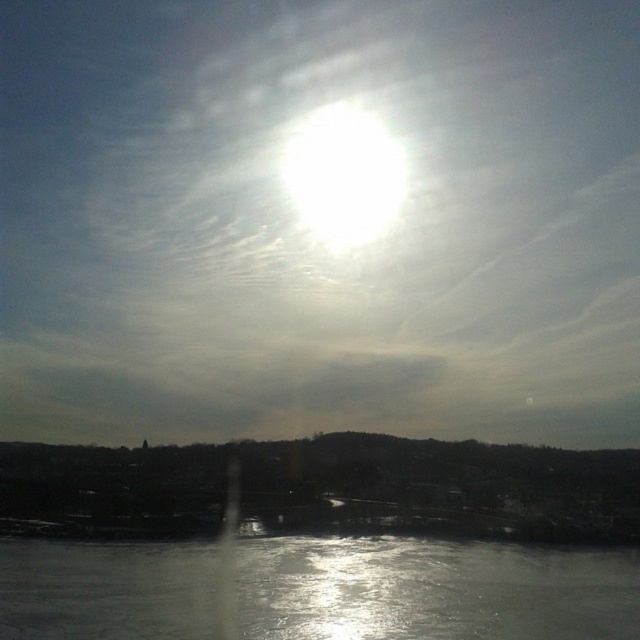
You are a photographer standing at the edge of the glistening ice at bottom, aiming to capture the bright white sun at upper center in your shot. Considering the distance between them, would you need to adjust your camera settings to account for the brightness difference?

The distance between the bright white sun at upper center and the glistening ice at bottom is 140.74 meters. Since the sun is extremely bright and the ice is much closer, you should adjust your camera settings to balance exposure, perhaps using a graduated neutral density filter to handle the extreme contrast between the bright sun and the darker ice.

You are an astronomer observing the winter landscape. You notice the bright white sun at upper center and the glistening ice at bottom. Which object appears bigger in the image?

The bright white sun at upper center appears larger than the glistening ice at bottom in the image.

You are an astronomer observing the winter landscape. You notice the bright white sun at upper center and the glistening ice at bottom. Which object has a greater width in the image?

The bright white sun at upper center has a greater width than the glistening ice at bottom according to the description.